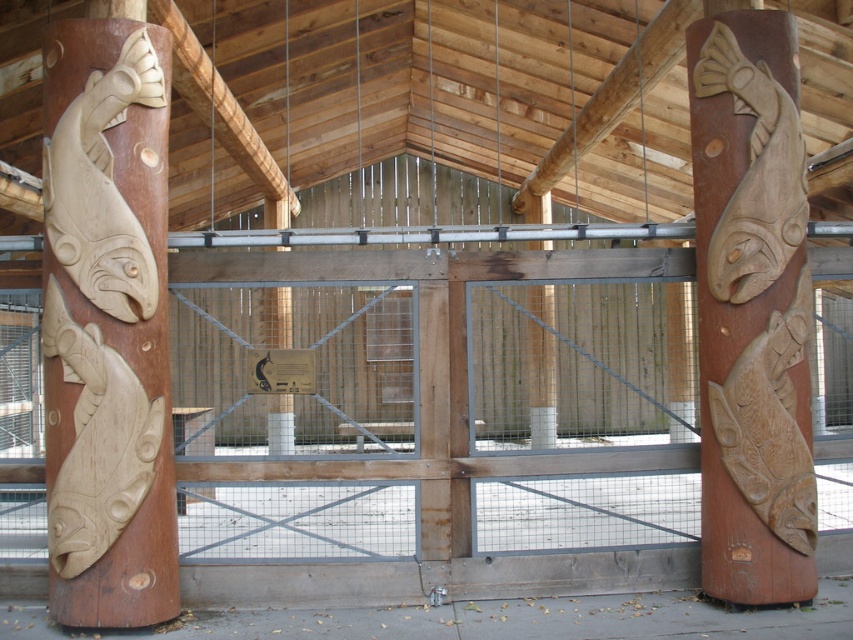
Is natural wood fish at left wider than wooden carved fish at right?

Yes.

Between point (56, 275) and point (733, 579), which one is positioned behind?

Point (733, 579)

Where is `natural wood fish at left`? natural wood fish at left is located at coordinates (107, 326).